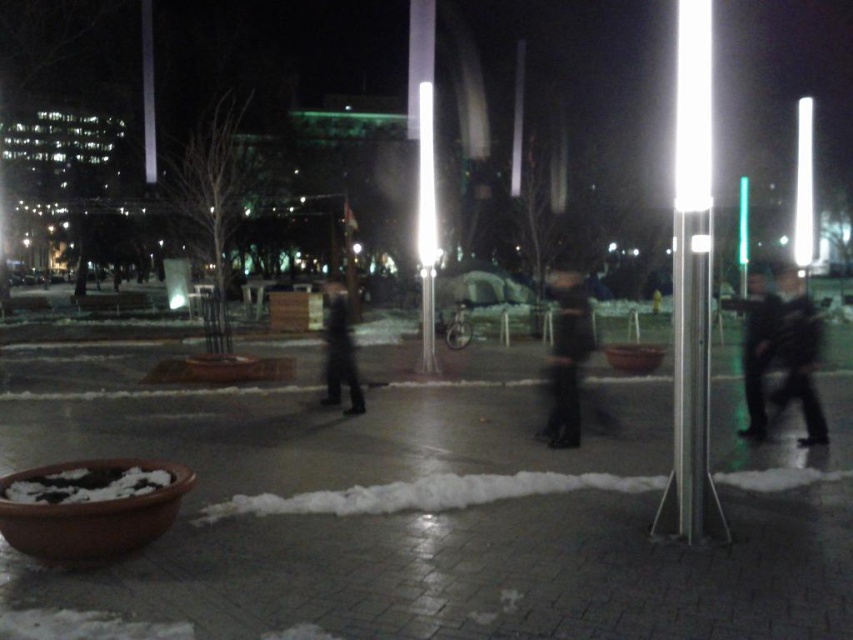
You are standing at the point with coordinates point [587,326] and want to walk towards the point with coordinates point [815,346]. Considering the scene described, will the path between these two points be obstructed by any objects?

Point [815,346] is behind point [587,326], so the path between them would be obstructed by point [587,326] itself.

You are a photographer trying to capture a clear shot of both the dark fabric jacket at right and the dark fabric jacket at center. Since they are both dark, you want to ensure you can distinguish them in the photo. Based on their positions, which jacket should you focus on first to ensure it appears in the foreground?

The dark fabric jacket at right is located above the dark fabric jacket at center. To ensure the jacket in the foreground is in focus first, you should focus on the dark fabric jacket at center since it is lower and closer to the camera.

You are standing in the snowy urban area and want to take a photo of the dark gray fabric jacket at right without the white glossy pole at center appearing in the frame. Is this possible?

The white glossy pole at center is positioned over dark gray fabric jacket at right, so it would block the view. To avoid the pole, you need to move to a different angle or position where the pole is no longer directly in front of the jacket.